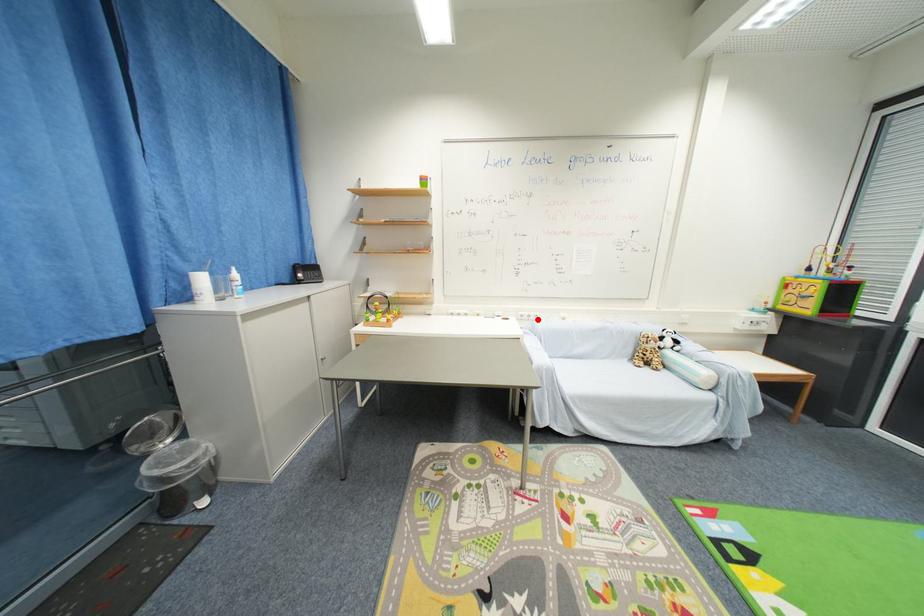
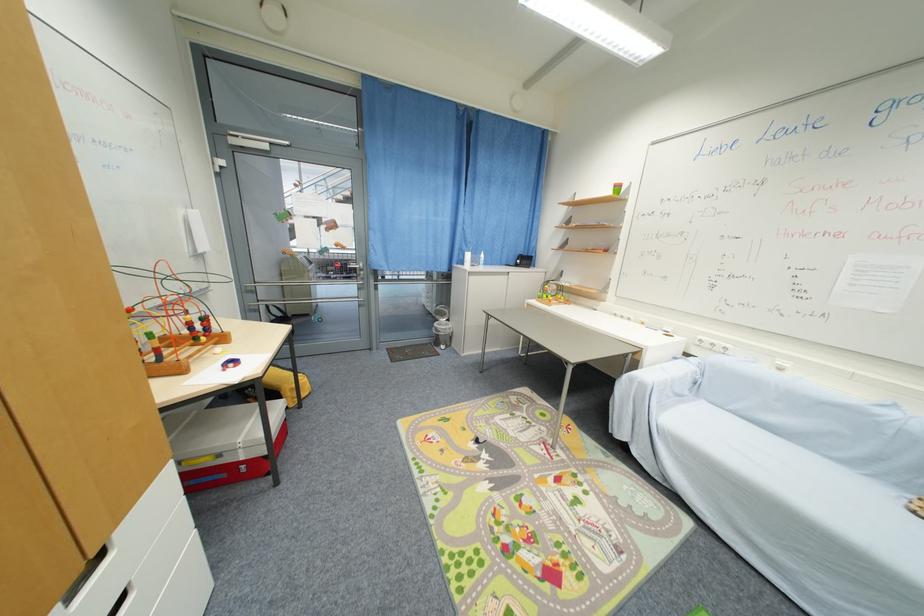
The point at the highlighted location is marked in the first image. Where is the corresponding point in the second image?

(723, 351)